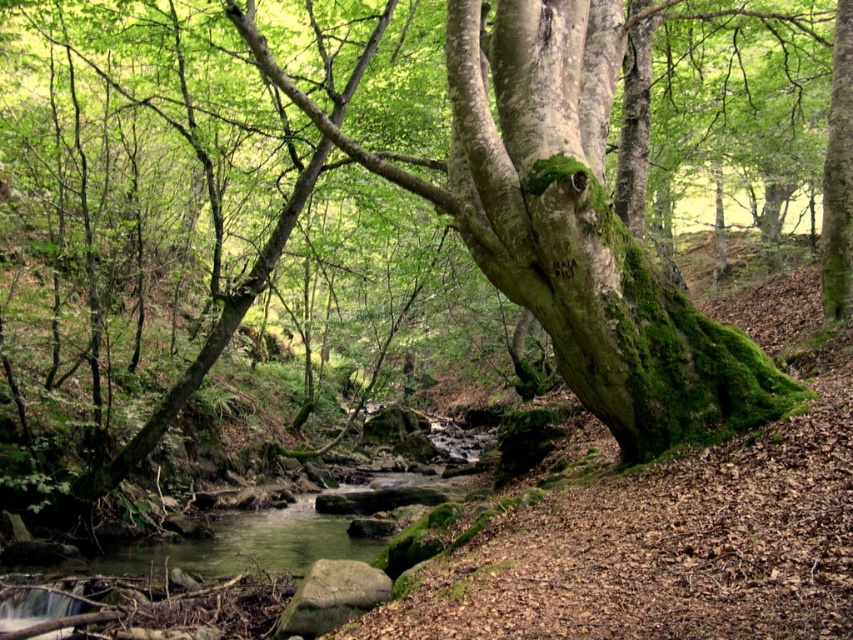
You are an environmental scientist assessing the health of this forest. You observe the green mossy tree trunk at center and the green mossy tree trunk at upper right. Which tree trunk has a greater width, and what might this indicate about its age?

The green mossy tree trunk at center has a greater width than the green mossy tree trunk at upper right. This suggests that the tree at center is older, as wider tree trunks typically indicate greater age due to years of growth.

You are a hiker standing in the forest and see the green mossy tree trunk at center and the green mossy tree trunk at upper right. Which tree trunk is closer to you?

The green mossy tree trunk at center is closer to you because it is in front of the green mossy tree trunk at upper right.